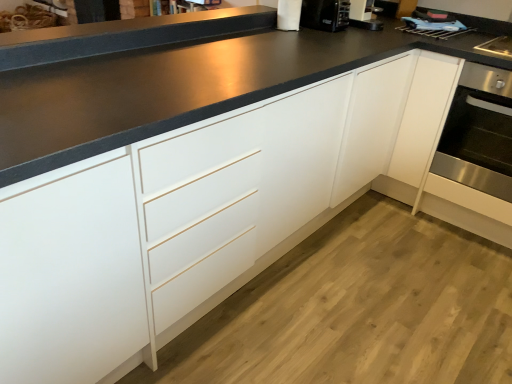
The image size is (512, 384). Find the location of `free space in front of white paper towel at upper center`. free space in front of white paper towel at upper center is located at coordinates (286, 39).